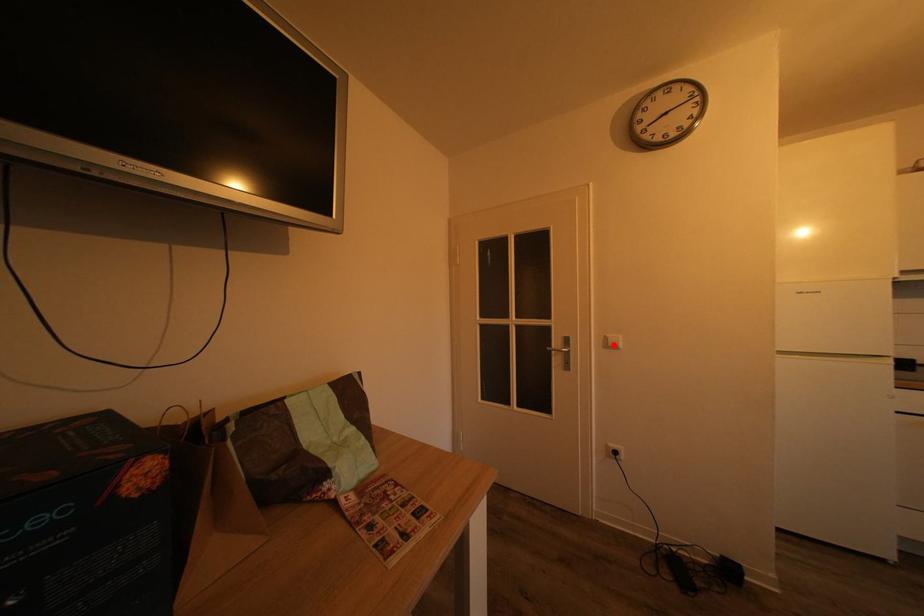
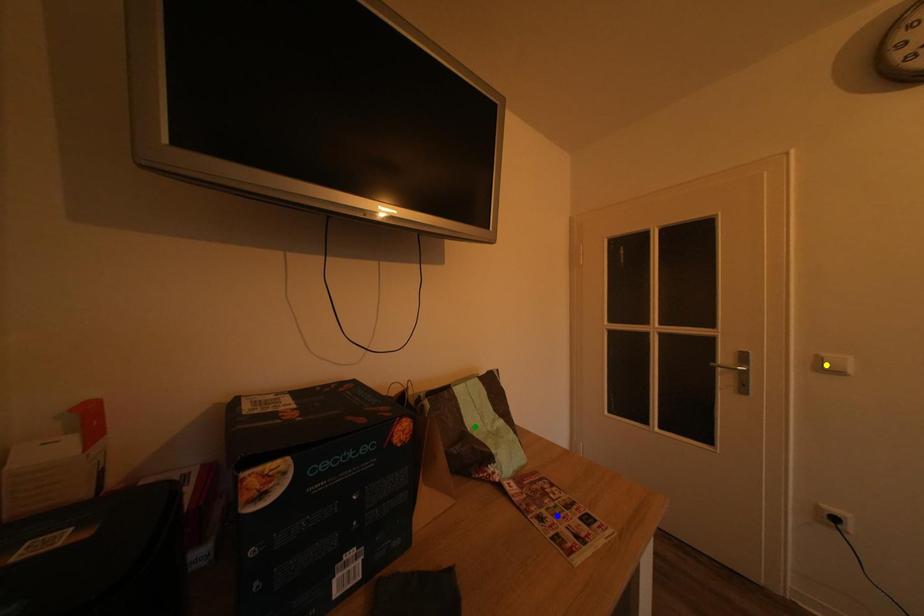
Question: I am providing you with two images of the same scene from different viewpoints. A red point is marked on the first image. You are given multiple points on the second image. Which point in image 2 represents the same 3d spot as the red point in image 1?

Choices:
 (A) yellow point
 (B) green point
 (C) blue point

Answer: (A)